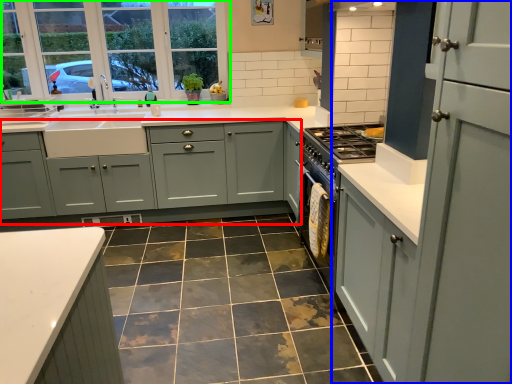
Question: Estimate the real-world distances between objects in this image. Which object is closer to cabinetry (highlighted by a red box), cabinetry (highlighted by a blue box) or window (highlighted by a green box)?

Choices:
 (A) cabinetry
 (B) window

Answer: (B)